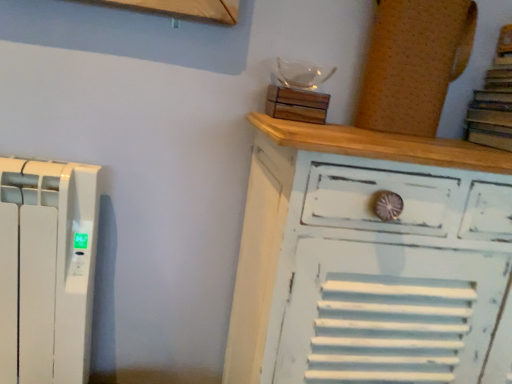
Where is `brown paper book at upper right`? The image size is (512, 384). brown paper book at upper right is located at coordinates (493, 107).

Measure the distance between point (277,101) and camera.

They are 37.28 inches apart.

Locate an element on the screen. The image size is (512, 384). white distressed wood chest of drawers at upper right is located at coordinates (371, 259).

Between white distressed wood chest of drawers at upper right and wooden block at upper center, positioned as the 2th wood in right-to-left order, which one appears on the right side from the viewer's perspective?

Positioned to the right is white distressed wood chest of drawers at upper right.

Which is farther, [317,128] or [310,113]?

The point [310,113] is farther.

In the scene shown: Measure the distance from white distressed wood chest of drawers at upper right to wooden block at upper center, which is counted as the 1th wood, starting from the left.

white distressed wood chest of drawers at upper right is 12.77 inches from wooden block at upper center, which is counted as the 1th wood, starting from the left.

Which object is closer to the camera taking this photo, white distressed wood chest of drawers at upper right or wooden block at upper center, which is counted as the 1th wood, starting from the left?

white distressed wood chest of drawers at upper right is in front.

Does white distressed wood chest of drawers at upper right turn towards brown paper book at upper right?

No, white distressed wood chest of drawers at upper right does not turn towards brown paper book at upper right.

Does white distressed wood chest of drawers at upper right appear on the right side of brown paper book at upper right?

No.

Which is less distant, (224,370) or (495,138)?

The point (495,138) is in front.

Would you say white distressed wood chest of drawers at upper right contains brown paper book at upper right?

No.

From the picture: Does cork board at upper right, which is the first wood from right to left, come in front of wooden block at upper center, positioned as the 2th wood in right-to-left order?

Yes, cork board at upper right, which is the first wood from right to left, is in front of wooden block at upper center, positioned as the 2th wood in right-to-left order.

Can you confirm if cork board at upper right, which is the first wood from right to left, is smaller than wooden block at upper center, positioned as the 2th wood in right-to-left order?

No.

How many degrees apart are the facing directions of cork board at upper right, the second wood when ordered from left to right, and wooden block at upper center, positioned as the 2th wood in right-to-left order?

There is a 2.87-degree angle between the facing directions of cork board at upper right, the second wood when ordered from left to right, and wooden block at upper center, positioned as the 2th wood in right-to-left order.

Can you confirm if cork board at upper right, which is the first wood from right to left, is positioned to the right of wooden block at upper center, which is counted as the 1th wood, starting from the left?

Yes, cork board at upper right, which is the first wood from right to left, is to the right of wooden block at upper center, which is counted as the 1th wood, starting from the left.

Is wooden block at upper center, which is counted as the 1th wood, starting from the left, at the left side of cork board at upper right, which is the first wood from right to left?

Yes, wooden block at upper center, which is counted as the 1th wood, starting from the left, is to the left of cork board at upper right, which is the first wood from right to left.

Considering the sizes of objects wooden block at upper center, which is counted as the 1th wood, starting from the left, and cork board at upper right, which is the first wood from right to left, in the image provided, who is thinner, wooden block at upper center, which is counted as the 1th wood, starting from the left, or cork board at upper right, which is the first wood from right to left,?

cork board at upper right, which is the first wood from right to left, is thinner.

How many degrees apart are the facing directions of wooden block at upper center, which is counted as the 1th wood, starting from the left, and cork board at upper right, the second wood when ordered from left to right?

wooden block at upper center, which is counted as the 1th wood, starting from the left, and cork board at upper right, the second wood when ordered from left to right, are facing 2.87 degrees away from each other.

Does point (268, 109) come closer to viewer compared to point (376, 94)?

Yes, it is in front of point (376, 94).

Which of these two, white distressed wood chest of drawers at upper right or cork board at upper right, which is the first wood from right to left, is wider?

white distressed wood chest of drawers at upper right is wider.

Which of these two, white distressed wood chest of drawers at upper right or cork board at upper right, which is the first wood from right to left, is bigger?

white distressed wood chest of drawers at upper right is bigger.

Between white distressed wood chest of drawers at upper right and cork board at upper right, which is the first wood from right to left, which one appears on the left side from the viewer's perspective?

Positioned to the left is cork board at upper right, which is the first wood from right to left.

Does white distressed wood chest of drawers at upper right turn towards cork board at upper right, which is the first wood from right to left?

No, white distressed wood chest of drawers at upper right is not oriented towards cork board at upper right, which is the first wood from right to left.

How many degrees apart are the facing directions of wooden block at upper center, which is counted as the 1th wood, starting from the left, and white distressed wood chest of drawers at upper right?

There is a 3.49-degree angle between the facing directions of wooden block at upper center, which is counted as the 1th wood, starting from the left, and white distressed wood chest of drawers at upper right.

Based on their sizes in the image, would you say wooden block at upper center, which is counted as the 1th wood, starting from the left, is bigger or smaller than white distressed wood chest of drawers at upper right?

wooden block at upper center, which is counted as the 1th wood, starting from the left, is smaller than white distressed wood chest of drawers at upper right.

Identify the location of chest of drawers on the right of wooden block at upper center, positioned as the 2th wood in right-to-left order. The image size is (512, 384). 371,259.

Who is taller, wooden block at upper center, which is counted as the 1th wood, starting from the left, or white distressed wood chest of drawers at upper right?

white distressed wood chest of drawers at upper right is taller.

Which point is more distant from viewer, (366, 92) or (494, 66)?

The point (494, 66) is farther from the camera.

Is the position of cork board at upper right, which is the first wood from right to left, more distant than that of brown paper book at upper right?

Yes, the depth of cork board at upper right, which is the first wood from right to left, is greater than that of brown paper book at upper right.

From a real-world perspective, is cork board at upper right, the second wood when ordered from left to right, located beneath brown paper book at upper right?

No, from a real-world perspective, cork board at upper right, the second wood when ordered from left to right, is not beneath brown paper book at upper right.

In terms of width, does cork board at upper right, which is the first wood from right to left, look wider or thinner when compared to brown paper book at upper right?

cork board at upper right, which is the first wood from right to left, is thinner than brown paper book at upper right.

You are a GUI agent. You are given a task and a screenshot of the screen. Output one action in this format:
    pyautogui.click(x=<x>, y=<y>)
    Task: Click on the 2nd wood behind the white distressed wood chest of drawers at upper right, counting from the anchor's position
    The image size is (512, 384).
    Given the screenshot: What is the action you would take?
    pyautogui.click(x=296, y=105)

At what (x,y) coordinates should I click in order to perform the action: click on chest of drawers on the left of brown paper book at upper right. Please return your answer as a coordinate pair (x, y). Looking at the image, I should click on (371, 259).

From the picture: Which object lies nearer to the anchor point wooden block at upper center, which is counted as the 1th wood, starting from the left, cork board at upper right, which is the first wood from right to left, or white distressed wood chest of drawers at upper right?

The object closer to wooden block at upper center, which is counted as the 1th wood, starting from the left, is cork board at upper right, which is the first wood from right to left.

Looking at this image, looking at the image, which one is located further to white distressed wood chest of drawers at upper right, cork board at upper right, the second wood when ordered from left to right, or wooden block at upper center, positioned as the 2th wood in right-to-left order?

cork board at upper right, the second wood when ordered from left to right, is further to white distressed wood chest of drawers at upper right.

Looking at the image, which one is located further to brown paper book at upper right, white distressed wood chest of drawers at upper right or cork board at upper right, the second wood when ordered from left to right?

white distressed wood chest of drawers at upper right is further to brown paper book at upper right.

When comparing their distances from brown paper book at upper right, does white distressed wood chest of drawers at upper right or wooden block at upper center, positioned as the 2th wood in right-to-left order, seem further?

white distressed wood chest of drawers at upper right is positioned further to the anchor brown paper book at upper right.

Looking at the image, which one is located closer to white distressed wood chest of drawers at upper right, brown paper book at upper right or cork board at upper right, the second wood when ordered from left to right?

Based on the image, cork board at upper right, the second wood when ordered from left to right, appears to be nearer to white distressed wood chest of drawers at upper right.

Looking at the image, which one is located further to white distressed wood chest of drawers at upper right, wooden block at upper center, positioned as the 2th wood in right-to-left order, or brown paper book at upper right?

brown paper book at upper right lies further to white distressed wood chest of drawers at upper right than the other object.

From the image, which object appears to be farther from brown paper book at upper right, wooden block at upper center, positioned as the 2th wood in right-to-left order, or cork board at upper right, which is the first wood from right to left?

wooden block at upper center, positioned as the 2th wood in right-to-left order.

Which object lies nearer to the anchor point wooden block at upper center, positioned as the 2th wood in right-to-left order, white distressed wood chest of drawers at upper right or brown paper book at upper right?

Based on the image, white distressed wood chest of drawers at upper right appears to be nearer to wooden block at upper center, positioned as the 2th wood in right-to-left order.

This screenshot has width=512, height=384. Identify the location of wood between wooden block at upper center, positioned as the 2th wood in right-to-left order, and brown paper book at upper right. (414, 63).

I want to click on wood between cork board at upper right, which is the first wood from right to left, and white distressed wood chest of drawers at upper right from top to bottom, so click(x=296, y=105).

Identify the location of wood between brown paper book at upper right and white distressed wood chest of drawers at upper right vertically. (296, 105).

The width and height of the screenshot is (512, 384). Find the location of `book between cork board at upper right, the second wood when ordered from left to right, and white distressed wood chest of drawers at upper right in the up-down direction`. book between cork board at upper right, the second wood when ordered from left to right, and white distressed wood chest of drawers at upper right in the up-down direction is located at coordinates (493, 107).